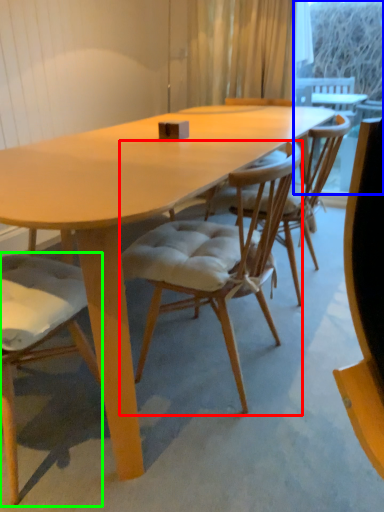
Question: Which object is positioned closest to chair (highlighted by a red box)? Select from window screen (highlighted by a blue box) and chair (highlighted by a green box).

Choices:
 (A) window screen
 (B) chair

Answer: (B)